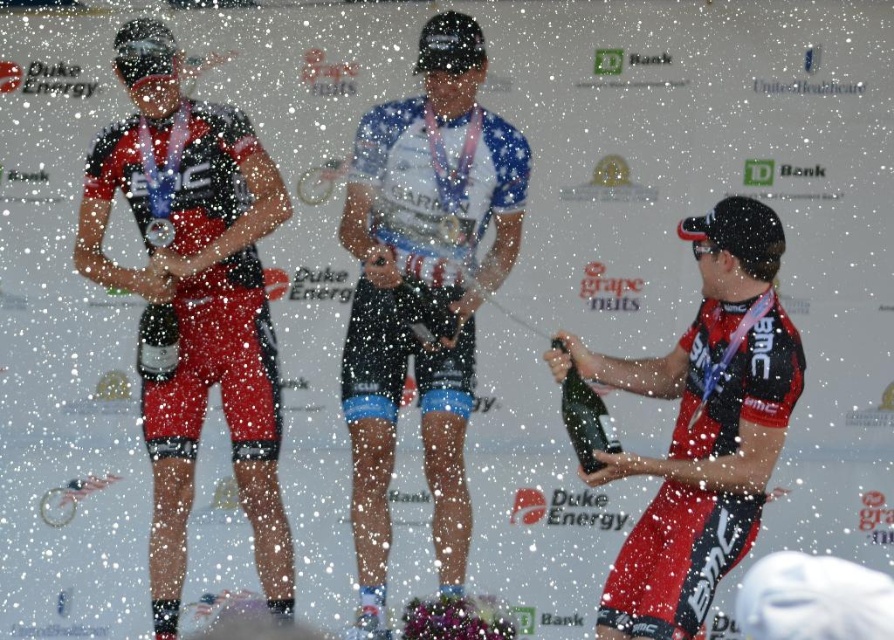
Is matte black suit at left smaller than shiny silver bottle at right?

No.

Is point (283, 557) in front of point (580, 449)?

No, it is not.

Find the location of `matte black suit at left`. matte black suit at left is located at coordinates (192, 301).

Which is behind, point (422, 198) or point (664, 554)?

Point (422, 198)

Consider the image. Which is more to the right, white matte jersey at center or matte black jersey at right?

matte black jersey at right

Image resolution: width=894 pixels, height=640 pixels. Describe the element at coordinates (423, 289) in the screenshot. I see `white matte jersey at center` at that location.

This screenshot has height=640, width=894. Find the location of `white matte jersey at center`. white matte jersey at center is located at coordinates (423, 289).

Is matte black jersey at right in front of metallic silver medal at center?

That is True.

From the picture: Which of these two, matte black jersey at right or metallic silver medal at center, stands shorter?

metallic silver medal at center is shorter.

At what (x,y) coordinates should I click in order to perform the action: click on matte black jersey at right. Please return your answer as a coordinate pair (x, y). The image size is (894, 640). Looking at the image, I should click on (701, 426).